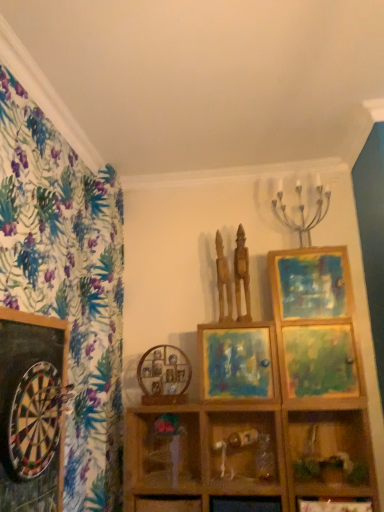
Question: Does wooden statue at upper center, arranged as the 1th sculpture when viewed from the left, contain wooden statue at upper center, the 1th sculpture viewed from the right?

Choices:
 (A) yes
 (B) no

Answer: (B)

Question: Could you tell me if wooden statue at upper center, arranged as the 1th sculpture when viewed from the left, is facing wooden statue at upper center, the 1th sculpture viewed from the right?

Choices:
 (A) yes
 (B) no

Answer: (B)

Question: Is wooden statue at upper center, arranged as the 1th sculpture when viewed from the left, next to wooden statue at upper center, the 1th sculpture viewed from the right?

Choices:
 (A) yes
 (B) no

Answer: (A)

Question: From the image's perspective, would you say wooden statue at upper center, arranged as the 1th sculpture when viewed from the left, is shown under wooden statue at upper center, the 1th sculpture viewed from the right?

Choices:
 (A) no
 (B) yes

Answer: (B)

Question: Does wooden statue at upper center, positioned as the 2th sculpture in right-to-left order, appear on the left side of wooden statue at upper center, marked as the 2th sculpture in a left-to-right arrangement?

Choices:
 (A) yes
 (B) no

Answer: (A)

Question: Considering the relative positions of wooden statue at upper center, marked as the 2th sculpture in a left-to-right arrangement, and wooden figurine at center, which is counted as the second shelf, starting from the left, in the image provided, is wooden statue at upper center, marked as the 2th sculpture in a left-to-right arrangement, to the left or to the right of wooden figurine at center, which is counted as the second shelf, starting from the left,?

Choices:
 (A) right
 (B) left

Answer: (A)

Question: Based on their sizes in the image, would you say wooden statue at upper center, the 1th sculpture viewed from the right, is bigger or smaller than wooden figurine at center, which is the second shelf in right-to-left order?

Choices:
 (A) big
 (B) small

Answer: (B)

Question: Does point (218, 245) appear closer or farther from the camera than point (236, 453)?

Choices:
 (A) farther
 (B) closer

Answer: (A)

Question: From a real-world perspective, is wooden statue at upper center, marked as the 2th sculpture in a left-to-right arrangement, above or below wooden figurine at center, which is the second shelf in right-to-left order?

Choices:
 (A) above
 (B) below

Answer: (A)

Question: Considering the positions of wooden statue at upper center, arranged as the 1th sculpture when viewed from the left, and wooden shelf at lower right, marked as the third shelf in a left-to-right arrangement, in the image, is wooden statue at upper center, arranged as the 1th sculpture when viewed from the left, taller or shorter than wooden shelf at lower right, marked as the third shelf in a left-to-right arrangement,?

Choices:
 (A) tall
 (B) short

Answer: (B)

Question: Would you say wooden statue at upper center, arranged as the 1th sculpture when viewed from the left, is to the left or to the right of wooden shelf at lower right, marked as the third shelf in a left-to-right arrangement, in the picture?

Choices:
 (A) left
 (B) right

Answer: (A)

Question: Based on their sizes in the image, would you say wooden statue at upper center, positioned as the 2th sculpture in right-to-left order, is bigger or smaller than wooden shelf at lower right, marked as the third shelf in a left-to-right arrangement?

Choices:
 (A) big
 (B) small

Answer: (B)

Question: Is point (221, 287) positioned closer to the camera than point (316, 419)?

Choices:
 (A) farther
 (B) closer

Answer: (A)

Question: From the image's perspective, relative to matte wooden picture frame at center, the 3th picture frame positioned from the left, is wooden vase at center above or below?

Choices:
 (A) below
 (B) above

Answer: (A)

Question: Based on their sizes in the image, would you say wooden vase at center is bigger or smaller than matte wooden picture frame at center, which ranks as the 2th picture frame in back-to-front order?

Choices:
 (A) big
 (B) small

Answer: (B)